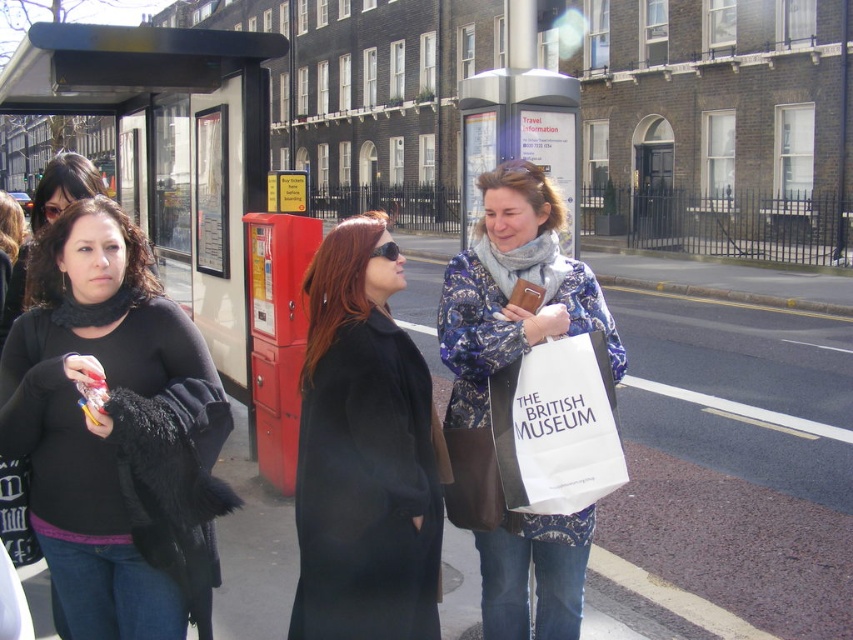
Question: From the image, what is the correct spatial relationship of floral-patterned coat at center in relation to white paper bag at center?

Choices:
 (A) right
 (B) left

Answer: (B)

Question: Considering the real-world distances, which object is farthest from the black fuzzy coat at left?

Choices:
 (A) smooth concrete pavement at center
 (B) black wool coat at center

Answer: (A)

Question: Can you confirm if black wool coat at center is wider than floral-patterned coat at center?

Choices:
 (A) yes
 (B) no

Answer: (B)

Question: From the image, what is the correct spatial relationship of black wool coat at center in relation to white paper bag at center?

Choices:
 (A) below
 (B) above

Answer: (B)

Question: Based on their relative distances, which object is farther from the black fuzzy coat at left?

Choices:
 (A) floral-patterned coat at center
 (B) smooth concrete pavement at center
 (C) white paper bag at center
 (D) black wool coat at center

Answer: (B)

Question: Which of these objects is positioned farthest from the black fuzzy coat at left?

Choices:
 (A) floral-patterned coat at center
 (B) smooth concrete pavement at center
 (C) white paper bag at center
 (D) black wool coat at center

Answer: (B)